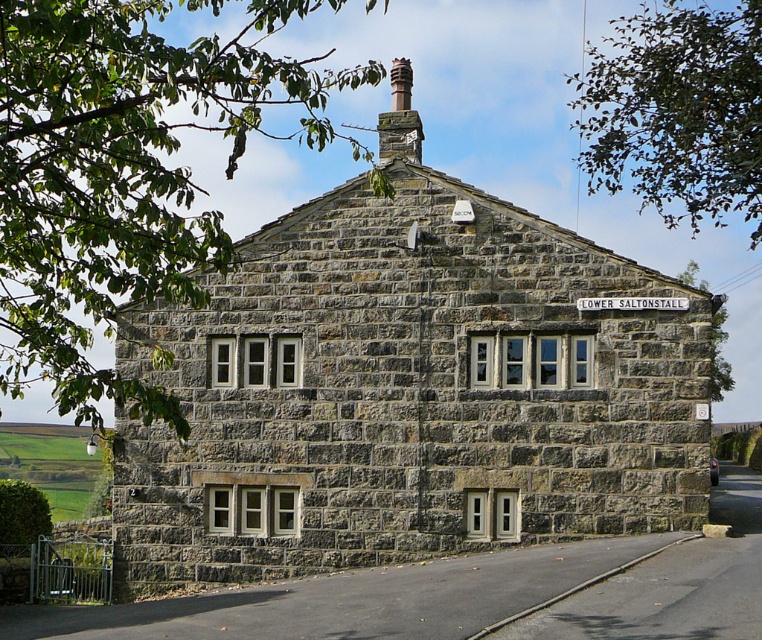
Which is above, smooth stone chimney at upper center or white plastic street sign at center?

smooth stone chimney at upper center

Is smooth stone chimney at upper center wider than white plastic street sign at center?

Correct, the width of smooth stone chimney at upper center exceeds that of white plastic street sign at center.

Is point (421, 138) less distant than point (642, 307)?

No, it is not.

The image size is (762, 640). What are the coordinates of `smooth stone chimney at upper center` in the screenshot? It's located at (399, 118).

Does stone cottage at center have a lesser height compared to white plastic street sign at center?

Incorrect, stone cottage at center's height does not fall short of white plastic street sign at center's.

Which is more to the left, stone cottage at center or white plastic street sign at center?

From the viewer's perspective, stone cottage at center appears more on the left side.

Is point (203, 566) in front of point (636, 305)?

No.

Identify the location of stone cottage at center. The width and height of the screenshot is (762, 640). (408, 394).

Is stone cottage at center smaller than smooth stone chimney at upper center?

No.

This screenshot has height=640, width=762. What do you see at coordinates (408, 394) in the screenshot?
I see `stone cottage at center` at bounding box center [408, 394].

Where is `stone cottage at center`? This screenshot has width=762, height=640. stone cottage at center is located at coordinates (408, 394).

Locate an element on the screen. The height and width of the screenshot is (640, 762). stone cottage at center is located at coordinates (408, 394).